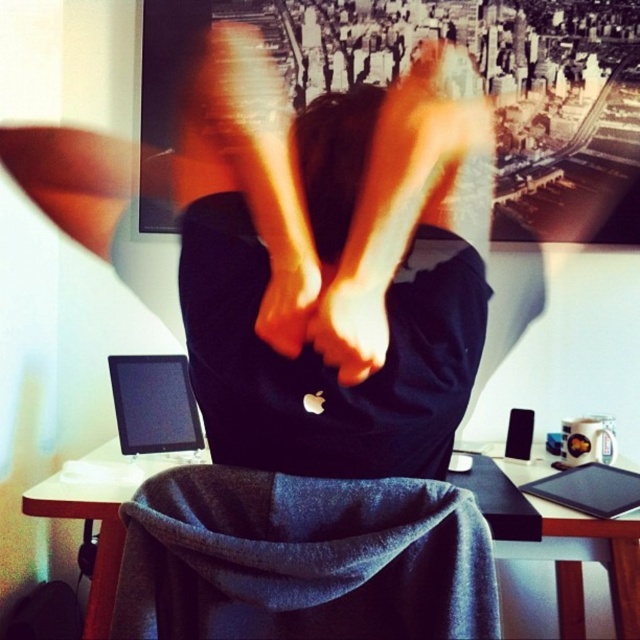
Between black matte hoodie at center and orange matte hand at center, which one is positioned higher?

black matte hoodie at center

Between black matte hoodie at center and orange matte hand at center, which one has more height?

Standing taller between the two is black matte hoodie at center.

Does point (442, 344) come closer to viewer compared to point (276, 316)?

No, it is not.

Where is `black matte hoodie at center`? The width and height of the screenshot is (640, 640). black matte hoodie at center is located at coordinates point(352,289).

Measure the distance from black matte hoodie at center to wooden table at center.

black matte hoodie at center is 31.36 inches away from wooden table at center.

At what (x,y) coordinates should I click in order to perform the action: click on black matte hoodie at center. Please return your answer as a coordinate pair (x, y). The image size is (640, 640). Looking at the image, I should click on (352, 289).

In order to click on black matte hoodie at center in this screenshot , I will do `click(352, 289)`.

Who is positioned more to the left, black matte hoodie at center or matte black hand at center?

From the viewer's perspective, black matte hoodie at center appears more on the left side.

Between black matte hoodie at center and matte black hand at center, which one is positioned lower?

Positioned lower is matte black hand at center.

Between point (413, 81) and point (323, 337), which one is positioned behind?

The point (413, 81) is more distant.

The height and width of the screenshot is (640, 640). Find the location of `black matte hoodie at center`. black matte hoodie at center is located at coordinates (352, 289).